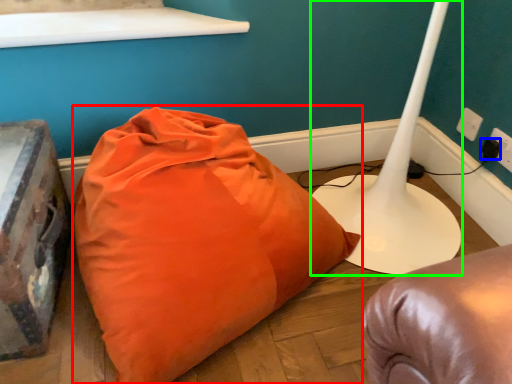
Question: Which object is positioned closest to pillow (highlighted by a red box)? Select from plug (highlighted by a blue box) and table lamp (highlighted by a green box).

Choices:
 (A) plug
 (B) table lamp

Answer: (B)